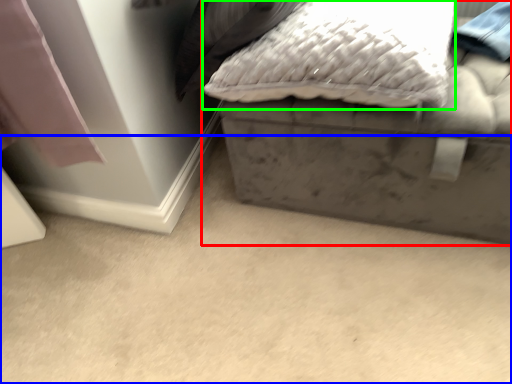
Question: Which object is positioned farthest from furniture (highlighted by a red box)? Select from concrete (highlighted by a blue box) and pillow (highlighted by a green box).

Choices:
 (A) concrete
 (B) pillow

Answer: (A)